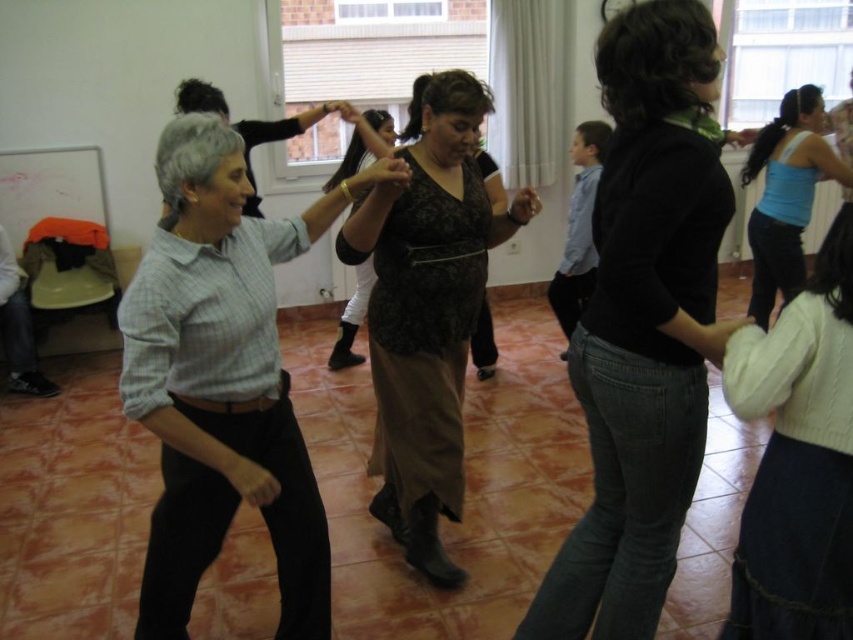
Is black sweater at center to the left of light blue plaid shirt at center from the viewer's perspective?

In fact, black sweater at center is to the right of light blue plaid shirt at center.

Does point (631, 355) come farther from viewer compared to point (318, 612)?

No.

The image size is (853, 640). Identify the location of black sweater at center. (643, 323).

Is black lace blouse at center shorter than matte blue tank top at right?

In fact, black lace blouse at center may be taller than matte blue tank top at right.

Can you confirm if black lace blouse at center is positioned below matte blue tank top at right?

Yes, black lace blouse at center is below matte blue tank top at right.

At what (x,y) coordinates should I click in order to perform the action: click on black lace blouse at center. Please return your answer as a coordinate pair (x, y). The height and width of the screenshot is (640, 853). Looking at the image, I should click on (427, 307).

Is black sweater at center positioned before white knit sweater at lower right?

No, black sweater at center is behind white knit sweater at lower right.

Can you confirm if black sweater at center is smaller than white knit sweater at lower right?

Indeed, black sweater at center has a smaller size compared to white knit sweater at lower right.

Looking at this image, who is more distant from viewer, (x=627, y=602) or (x=814, y=468)?

The point (x=627, y=602) is more distant.

The image size is (853, 640). Find the location of `black sweater at center`. black sweater at center is located at coordinates click(643, 323).